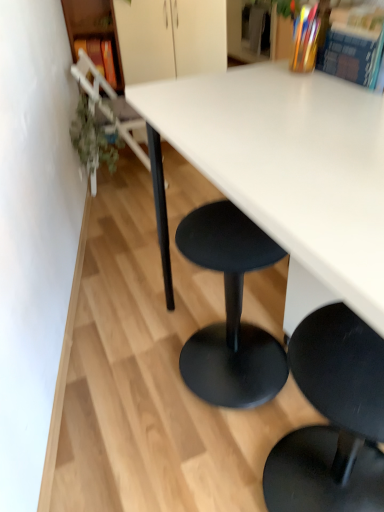
I want to click on green leafy plant at left, so click(x=93, y=139).

Measure the distance between point (100,2) and camera.

Point (100,2) and camera are 2.62 meters apart from each other.

I want to click on white matte table at center, so click(289, 164).

How much space does hardcover book at upper right, which ranks as the 3th book in top-to-bottom order, occupy vertically?

The height of hardcover book at upper right, which ranks as the 3th book in top-to-bottom order, is 5.55 inches.

Where is `multicolored paper book at upper right, which is the second book from left to right`? The image size is (384, 512). multicolored paper book at upper right, which is the second book from left to right is located at coordinates (305, 40).

Are matte orange book at upper left, the first book from the top, and green leafy plant at left beside each other?

No, matte orange book at upper left, the first book from the top, is not making contact with green leafy plant at left.

From a real-world perspective, is matte orange book at upper left, the 1th book in the left-to-right sequence, positioned under green leafy plant at left based on gravity?

No.

Could you tell me if matte orange book at upper left, marked as the 3th book in a bottom-to-top arrangement, is turned towards green leafy plant at left?

Yes, matte orange book at upper left, marked as the 3th book in a bottom-to-top arrangement, is turned towards green leafy plant at left.

Is matte orange book at upper left, the first book from the top, facing away from metallic silver chair at left, the second chair in the right-to-left sequence?

No.

Is matte orange book at upper left, the 3th book in the right-to-left sequence, positioned beyond the bounds of metallic silver chair at left, the second chair in the right-to-left sequence?

Yes, matte orange book at upper left, the 3th book in the right-to-left sequence, is located beyond the bounds of metallic silver chair at left, the second chair in the right-to-left sequence.

From the image's perspective, which is below, matte orange book at upper left, which appears as the 1th book when viewed from the back, or metallic silver chair at left, the second chair in the right-to-left sequence?

metallic silver chair at left, the second chair in the right-to-left sequence, appears lower in the image.

Is wooden bookshelf at left not close to black matte stool at lower right, the first chair in the front-to-back sequence?

Indeed, wooden bookshelf at left is not near black matte stool at lower right, the first chair in the front-to-back sequence.

Considering the sizes of objects wooden bookshelf at left and black matte stool at lower right, which is the first chair from bottom to top, in the image provided, who is bigger, wooden bookshelf at left or black matte stool at lower right, which is the first chair from bottom to top,?

Bigger between the two is black matte stool at lower right, which is the first chair from bottom to top.

Looking at their sizes, would you say wooden bookshelf at left is wider or thinner than black matte stool at lower right, marked as the 2th chair in a top-to-bottom arrangement?

Considering their sizes, wooden bookshelf at left looks slimmer than black matte stool at lower right, marked as the 2th chair in a top-to-bottom arrangement.

From a real-world perspective, is wooden bookshelf at left under black matte stool at lower right, marked as the 2th chair in a top-to-bottom arrangement?

No, from a real-world perspective, wooden bookshelf at left is not under black matte stool at lower right, marked as the 2th chair in a top-to-bottom arrangement.

In terms of size, does wooden bookshelf at left appear bigger or smaller than green leafy plant at left?

wooden bookshelf at left is bigger than green leafy plant at left.

Is wooden bookshelf at left thinner than green leafy plant at left?

No, wooden bookshelf at left is not thinner than green leafy plant at left.

Considering the points (89, 6) and (81, 105), which point is behind, point (89, 6) or point (81, 105)?

The point (89, 6) is farther.

Considering the positions of objects wooden bookshelf at left and green leafy plant at left in the image provided, who is more to the left, wooden bookshelf at left or green leafy plant at left?

Positioned to the left is wooden bookshelf at left.

From the image's perspective, between green leafy plant at left and matte orange book at upper left, which appears as the 1th book when viewed from the back, who is located below?

From the image's view, green leafy plant at left is below.

This screenshot has height=512, width=384. In the image, there is a green leafy plant at left. Identify the location of book above it (from the image's perspective). (99, 57).

What's the angular difference between green leafy plant at left and matte orange book at upper left, the 3th book in the right-to-left sequence,'s facing directions?

The facing directions of green leafy plant at left and matte orange book at upper left, the 3th book in the right-to-left sequence, are 91.4 degrees apart.

From a real-world perspective, between green leafy plant at left and matte orange book at upper left, the 1th book in the left-to-right sequence, who is vertically higher?

From a 3D spatial view, matte orange book at upper left, the 1th book in the left-to-right sequence, is above.

Is hardcover book at upper right, acting as the first book starting from the bottom, surrounded by wooden bookshelf at left?

No, wooden bookshelf at left does not contain hardcover book at upper right, acting as the first book starting from the bottom.

Does wooden bookshelf at left turn towards hardcover book at upper right, acting as the first book starting from the bottom?

No, wooden bookshelf at left is not facing towards hardcover book at upper right, acting as the first book starting from the bottom.

From a real-world perspective, who is located lower, wooden bookshelf at left or hardcover book at upper right, the first book positioned from the right?

From a 3D spatial view, wooden bookshelf at left is below.

Looking at the image, does wooden bookshelf at left seem bigger or smaller compared to multicolored paper book at upper right, the second book from the top?

wooden bookshelf at left is bigger than multicolored paper book at upper right, the second book from the top.

Consider the image. From a real-world perspective, which object rests below the other?

From a 3D spatial view, wooden bookshelf at left is below.

Considering the sizes of wooden bookshelf at left and multicolored paper book at upper right, the second book from the top, in the image, is wooden bookshelf at left taller or shorter than multicolored paper book at upper right, the second book from the top,?

In the image, wooden bookshelf at left appears to be taller than multicolored paper book at upper right, the second book from the top.

Is multicolored paper book at upper right, which is the second book from left to right, at the back of wooden bookshelf at left?

No, wooden bookshelf at left's orientation is not away from multicolored paper book at upper right, which is the second book from left to right.

This screenshot has height=512, width=384. In order to click on plant in front of the matte orange book at upper left, the third book when ordered from front to back in this screenshot , I will do `click(93, 139)`.

Where is `book on the left side of metallic silver chair at left, acting as the second chair starting from the front`? The width and height of the screenshot is (384, 512). book on the left side of metallic silver chair at left, acting as the second chair starting from the front is located at coordinates point(99,57).

Considering their positions, is green leafy plant at left positioned further to metallic silver chair at left, the first chair positioned from the top, than hardcover book at upper right, the third book in the left-to-right sequence?

hardcover book at upper right, the third book in the left-to-right sequence, is further to metallic silver chair at left, the first chair positioned from the top.

Looking at this image, estimate the real-world distances between objects in this image. Which object is closer to hardcover book at upper right, which ranks as the 3th book in top-to-bottom order, metallic silver chair at left, the second chair in the right-to-left sequence, or matte orange book at upper left, the first book from the top?

metallic silver chair at left, the second chair in the right-to-left sequence.

Based on their spatial positions, is metallic silver chair at left, acting as the second chair starting from the front, or multicolored paper book at upper right, the second book from the top, further from wooden bookshelf at left?

multicolored paper book at upper right, the second book from the top, lies further to wooden bookshelf at left than the other object.

Estimate the real-world distances between objects in this image. Which object is further from white matte table at center, wooden bookshelf at left or matte orange book at upper left, which appears as the 1th book when viewed from the back?

wooden bookshelf at left is further to white matte table at center.

Considering their positions, is white matte table at center positioned closer to hardcover book at upper right, the 1th book in the front-to-back sequence, than green leafy plant at left?

The object closer to hardcover book at upper right, the 1th book in the front-to-back sequence, is white matte table at center.

Consider the image. Which object lies further to the anchor point matte orange book at upper left, marked as the 3th book in a bottom-to-top arrangement, multicolored paper book at upper right, placed as the second book when sorted from bottom to top, or white matte table at center?

The object further to matte orange book at upper left, marked as the 3th book in a bottom-to-top arrangement, is white matte table at center.

In the scene shown: Which object lies nearer to the anchor point black matte stool at lower right, marked as the second chair in a left-to-right arrangement, wooden bookshelf at left or multicolored paper book at upper right, which ranks as the second book in back-to-front order?

The object closer to black matte stool at lower right, marked as the second chair in a left-to-right arrangement, is multicolored paper book at upper right, which ranks as the second book in back-to-front order.

When comparing their distances from white matte table at center, does hardcover book at upper right, placed as the third book when sorted from back to front, or metallic silver chair at left, acting as the second chair starting from the front, seem closer?

Among the two, hardcover book at upper right, placed as the third book when sorted from back to front, is located nearer to white matte table at center.

Identify the location of plant between multicolored paper book at upper right, the second book from the top, and wooden bookshelf at left from front to back. (93, 139).

Identify the location of chair between hardcover book at upper right, acting as the first book starting from the bottom, and matte orange book at upper left, marked as the 3th book in a bottom-to-top arrangement, in the front-back direction. This screenshot has height=512, width=384. (107, 103).

Identify the location of shelf between white matte table at center and matte orange book at upper left, the third book when ordered from front to back, from front to back. This screenshot has width=384, height=512. (94, 30).

Where is `plant positioned between multicolored paper book at upper right, which ranks as the second book in back-to-front order, and metallic silver chair at left, which appears as the 1th chair when viewed from the left, from near to far`? The height and width of the screenshot is (512, 384). plant positioned between multicolored paper book at upper right, which ranks as the second book in back-to-front order, and metallic silver chair at left, which appears as the 1th chair when viewed from the left, from near to far is located at coordinates (93, 139).